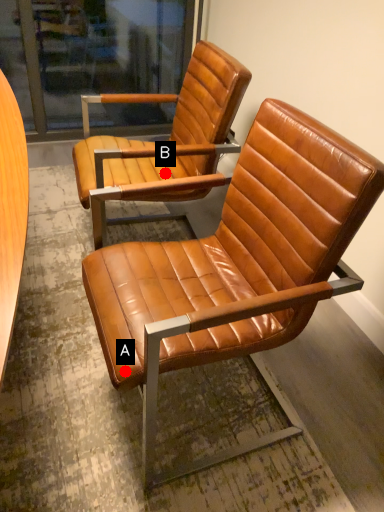
Question: Two points are circled on the image, labeled by A and B beside each circle. Which point appears farthest from the camera in this image?

Choices:
 (A) A is further
 (B) B is further

Answer: (B)